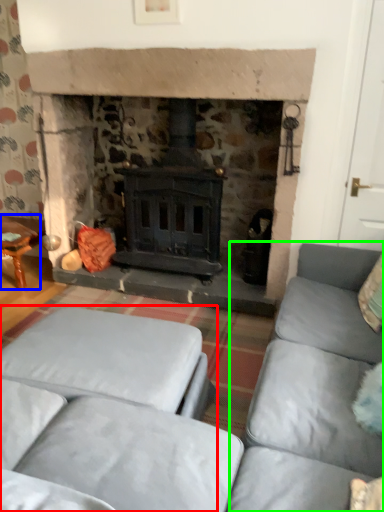
Question: Which is nearer to the studio couch (highlighted by a red box)? table (highlighted by a blue box) or couch (highlighted by a green box).

Choices:
 (A) table
 (B) couch

Answer: (B)